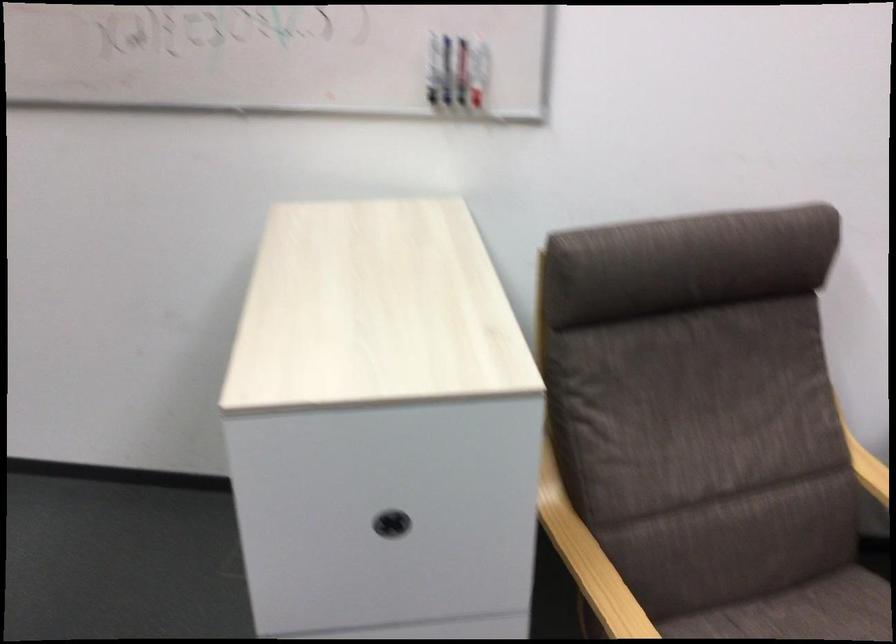
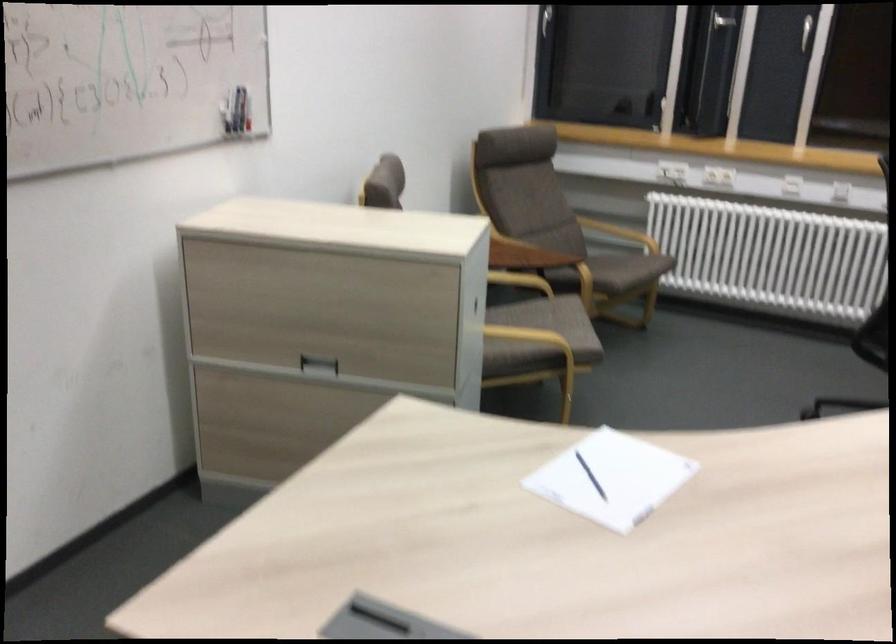
Locate, in the second image, the point that corresponds to point 478,79 in the first image.

(248, 114)